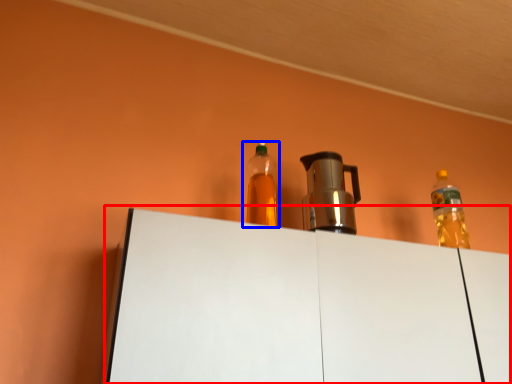
Question: Which object appears farthest to the camera in this image, table (highlighted by a red box) or bottle (highlighted by a blue box)?

Choices:
 (A) table
 (B) bottle

Answer: (B)